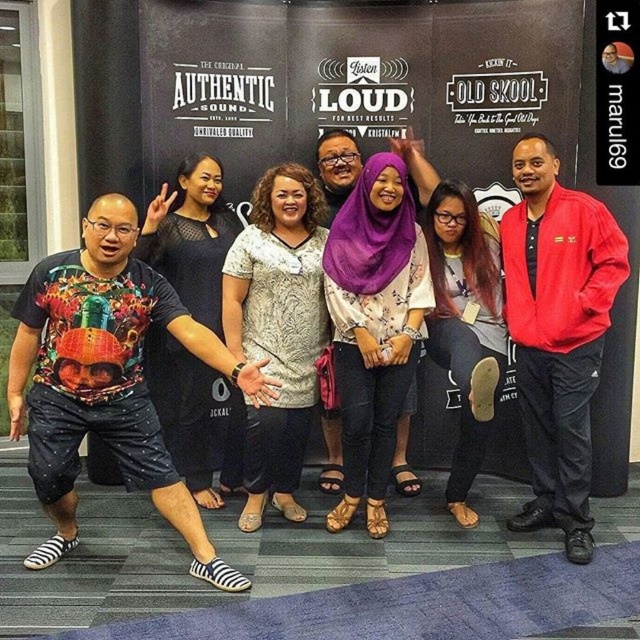
Between point (595, 288) and point (228, 259), which one is positioned behind?

Point (228, 259)

The image size is (640, 640). In order to click on red polyester jacket at right in this screenshot , I will do `click(557, 332)`.

Who is positioned more to the left, printed cotton t-shirt at left or purple floral blouse at center?

Positioned to the left is printed cotton t-shirt at left.

Who is higher up, printed cotton t-shirt at left or purple floral blouse at center?

purple floral blouse at center is higher up.

Who is more forward, (52,278) or (344,394)?

Point (52,278)

At what (x,y) coordinates should I click in order to perform the action: click on printed cotton t-shirt at left. Please return your answer as a coordinate pair (x, y). Looking at the image, I should click on (108, 380).

Is printed cotton t-shirt at left to the left of purple fabric hijab at center from the viewer's perspective?

Yes, printed cotton t-shirt at left is to the left of purple fabric hijab at center.

At what (x,y) coordinates should I click in order to perform the action: click on printed cotton t-shirt at left. Please return your answer as a coordinate pair (x, y). The width and height of the screenshot is (640, 640). Looking at the image, I should click on (108, 380).